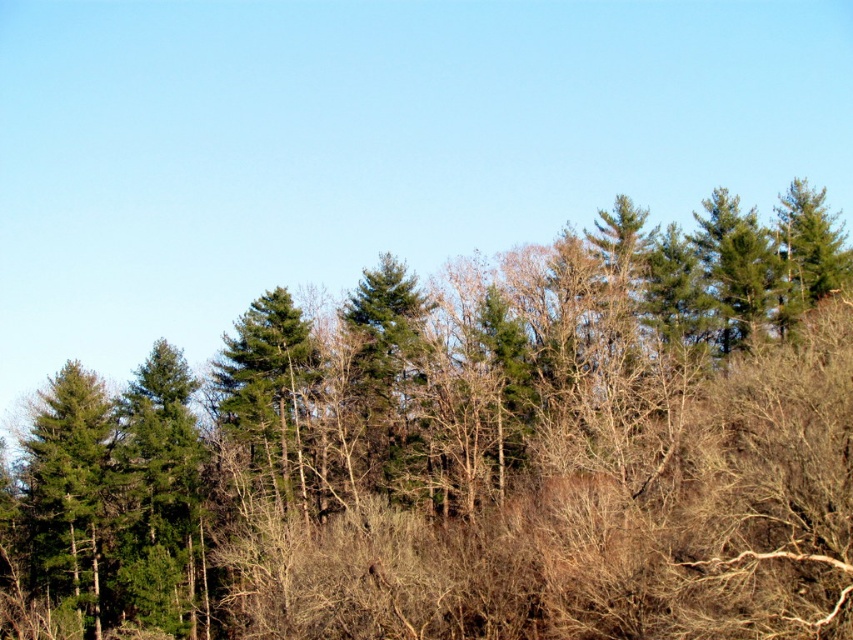
Which is above, green matte trees at center or green matte tree at left?

green matte trees at center

The height and width of the screenshot is (640, 853). I want to click on green matte trees at center, so click(471, 452).

Which is in front, point (531, 380) or point (50, 408)?

Point (531, 380) is in front.

At what (x,y) coordinates should I click in order to perform the action: click on green matte trees at center. Please return your answer as a coordinate pair (x, y). Looking at the image, I should click on (471, 452).